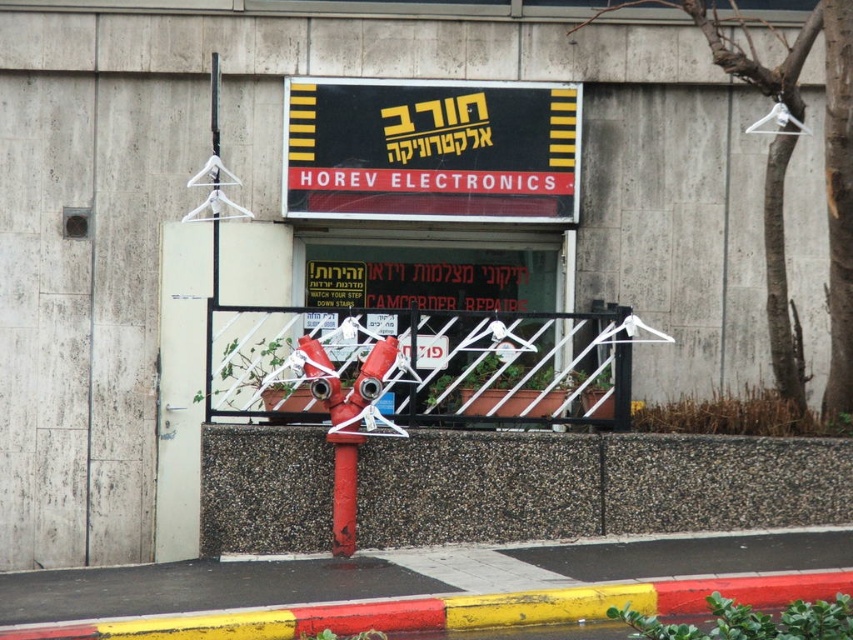
You are a delivery person trying to enter Horev Electronics. You see the metallic gate at center and the red matte fire hydrant at center. Which object is bigger?

The metallic gate at center is larger than the red matte fire hydrant at center.

You are a delivery person arriving at Horev Electronics. You need to park your van near the entrance but must avoid the red concrete barrier at lower center and the black plastic sign at center. Based on their positions, which object is closer to the entrance so you can park on the opposite side?

The red concrete barrier at lower center is located below the black plastic sign at center, meaning it is closer to the entrance. To park safely, you should position your van on the side opposite to the red concrete barrier at lower center.

You are a delivery person with a cart that is 1.5 meters wide. You need to deliver a package to the entrance of Horev Electronics. The entrance has a metallic gate at center and a black plastic sign at center. Can your cart fit through the space between them?

The metallic gate at center and black plastic sign at center are 1.25 meters apart from each other. Since your cart is 1.5 meters wide, it cannot fit through the space between them.